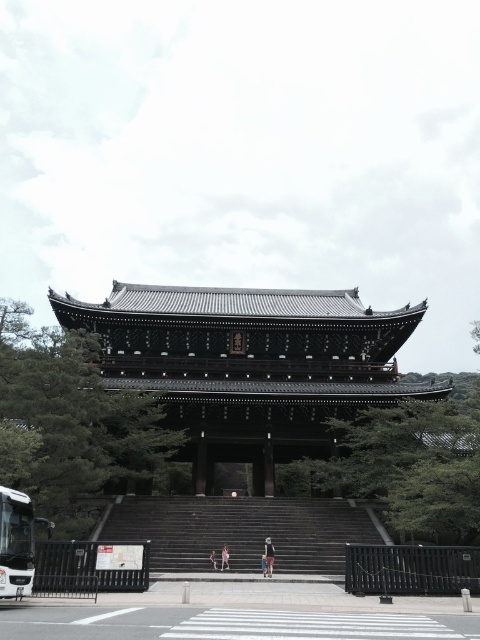
Is shiny dark wood temple at center bigger than dark gray stone stairs at center?

Correct, shiny dark wood temple at center is larger in size than dark gray stone stairs at center.

Does shiny dark wood temple at center have a greater height compared to dark gray stone stairs at center?

Indeed, shiny dark wood temple at center has a greater height compared to dark gray stone stairs at center.

Who is more forward, (248, 310) or (264, 509)?

Positioned in front is point (264, 509).

The height and width of the screenshot is (640, 480). Identify the location of shiny dark wood temple at center. (250, 364).

Can you confirm if white metallic bus at lower left is positioned below light purple fabric pants at center?

No, white metallic bus at lower left is not below light purple fabric pants at center.

Does white metallic bus at lower left have a lesser width compared to light purple fabric pants at center?

Incorrect, white metallic bus at lower left's width is not less than light purple fabric pants at center's.

Where is `white metallic bus at lower left`? The height and width of the screenshot is (640, 480). white metallic bus at lower left is located at coordinates (16, 541).

Based on the photo, which of these two, white metallic bus at lower left or light blue denim shorts at center, stands shorter?

Standing shorter between the two is light blue denim shorts at center.

Is white metallic bus at lower left thinner than light blue denim shorts at center?

No, white metallic bus at lower left is not thinner than light blue denim shorts at center.

Is point (0, 579) less distant than point (215, 566)?

Yes, it is.

The width and height of the screenshot is (480, 640). What are the coordinates of `white metallic bus at lower left` in the screenshot? It's located at (16, 541).